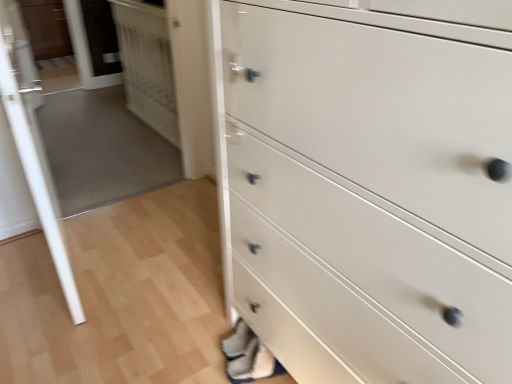
Question: Is matte brown cabinet at upper left positioned behind transparent glass door at upper left, the 1th glass door from the back?

Choices:
 (A) no
 (B) yes

Answer: (B)

Question: Is matte brown cabinet at upper left outside of transparent glass door at upper left, the 1th glass door from the back?

Choices:
 (A) yes
 (B) no

Answer: (A)

Question: Considering the relative positions of matte brown cabinet at upper left and transparent glass door at upper left, positioned as the 2th glass door in front-to-back order, in the image provided, is matte brown cabinet at upper left to the left of transparent glass door at upper left, positioned as the 2th glass door in front-to-back order, from the viewer's perspective?

Choices:
 (A) yes
 (B) no

Answer: (A)

Question: Does matte brown cabinet at upper left turn towards transparent glass door at upper left, positioned as the 2th glass door in front-to-back order?

Choices:
 (A) yes
 (B) no

Answer: (A)

Question: From a real-world perspective, is matte brown cabinet at upper left on transparent glass door at upper left, the 1th glass door from the back?

Choices:
 (A) yes
 (B) no

Answer: (B)

Question: Considering the positions of transparent glass door at left, the first glass door viewed from the front, and transparent glass door at upper left, the 1th glass door from the back, in the image, is transparent glass door at left, the first glass door viewed from the front, bigger or smaller than transparent glass door at upper left, the 1th glass door from the back,?

Choices:
 (A) small
 (B) big

Answer: (B)

Question: From their relative heights in the image, would you say transparent glass door at left, which appears as the 2th glass door when viewed from the back, is taller or shorter than transparent glass door at upper left, positioned as the 2th glass door in front-to-back order?

Choices:
 (A) short
 (B) tall

Answer: (B)

Question: Is transparent glass door at left, which appears as the 2th glass door when viewed from the back, wider or thinner than transparent glass door at upper left, the 1th glass door from the back?

Choices:
 (A) thin
 (B) wide

Answer: (B)

Question: From a real-world perspective, is transparent glass door at left, the first glass door viewed from the front, above or below transparent glass door at upper left, the 1th glass door from the back?

Choices:
 (A) above
 (B) below

Answer: (A)

Question: Looking at the image, does matte brown cabinet at upper left seem bigger or smaller compared to transparent glass door at upper left, positioned as the 2th glass door in front-to-back order?

Choices:
 (A) small
 (B) big

Answer: (B)

Question: In terms of width, does matte brown cabinet at upper left look wider or thinner when compared to transparent glass door at upper left, the 1th glass door from the back?

Choices:
 (A) wide
 (B) thin

Answer: (A)

Question: Visually, is matte brown cabinet at upper left positioned to the left or to the right of transparent glass door at upper left, the 1th glass door from the back?

Choices:
 (A) left
 (B) right

Answer: (A)

Question: Is matte brown cabinet at upper left inside the boundaries of transparent glass door at upper left, positioned as the 2th glass door in front-to-back order, or outside?

Choices:
 (A) inside
 (B) outside

Answer: (B)

Question: From the image's perspective, is transparent glass door at upper left, positioned as the 2th glass door in front-to-back order, located above or below matte brown cabinet at upper left?

Choices:
 (A) above
 (B) below

Answer: (B)

Question: From a real-world perspective, is transparent glass door at upper left, the 1th glass door from the back, above or below matte brown cabinet at upper left?

Choices:
 (A) below
 (B) above

Answer: (B)